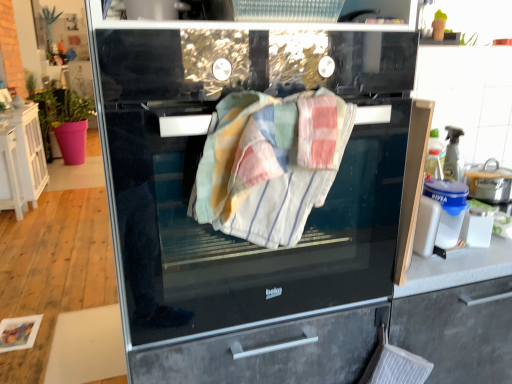
Question: From a real-world perspective, is patchwork cotton towel at center physically below blue plastic container at right?

Choices:
 (A) yes
 (B) no

Answer: (B)

Question: Does patchwork cotton towel at center turn towards blue plastic container at right?

Choices:
 (A) yes
 (B) no

Answer: (B)

Question: Is patchwork cotton towel at center at the right side of blue plastic container at right?

Choices:
 (A) no
 (B) yes

Answer: (A)

Question: Considering the relative sizes of patchwork cotton towel at center and blue plastic container at right in the image provided, is patchwork cotton towel at center thinner than blue plastic container at right?

Choices:
 (A) yes
 (B) no

Answer: (B)

Question: Considering the relative sizes of patchwork cotton towel at center and blue plastic container at right in the image provided, is patchwork cotton towel at center wider than blue plastic container at right?

Choices:
 (A) yes
 (B) no

Answer: (A)

Question: Are patchwork cotton towel at center and blue plastic container at right located far from each other?

Choices:
 (A) no
 (B) yes

Answer: (A)

Question: Is white wood cabinet at left bigger than black glass oven at center?

Choices:
 (A) yes
 (B) no

Answer: (B)

Question: Is white wood cabinet at left shorter than black glass oven at center?

Choices:
 (A) yes
 (B) no

Answer: (A)

Question: Is white wood cabinet at left oriented away from black glass oven at center?

Choices:
 (A) yes
 (B) no

Answer: (B)

Question: Is white wood cabinet at left outside of black glass oven at center?

Choices:
 (A) yes
 (B) no

Answer: (A)

Question: Is white wood cabinet at left wider than black glass oven at center?

Choices:
 (A) yes
 (B) no

Answer: (B)

Question: Is black glass oven at center surrounded by white wood cabinet at left?

Choices:
 (A) no
 (B) yes

Answer: (A)

Question: Is white wood cabinet at left smaller than patchwork cotton towel at center?

Choices:
 (A) yes
 (B) no

Answer: (B)